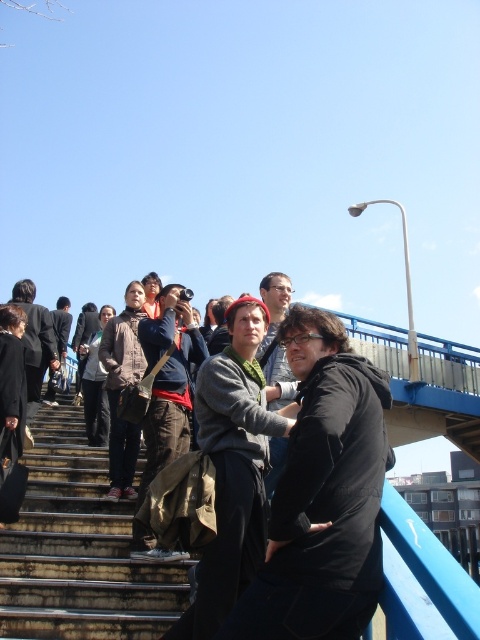
Question: Observing the image, what is the correct spatial positioning of dark gray hoodie at center in reference to rusty metal stairs at lower left?

Choices:
 (A) right
 (B) left

Answer: (B)

Question: Is dark gray hoodie at center to the left of rusty metal stairs at lower left from the viewer's perspective?

Choices:
 (A) no
 (B) yes

Answer: (B)

Question: Does dark gray hoodie at center appear on the left side of rusty metal stairs at lower left?

Choices:
 (A) no
 (B) yes

Answer: (B)

Question: Which object is closer to the camera taking this photo?

Choices:
 (A) rusty metal stairs at lower left
 (B) dark gray hoodie at center

Answer: (A)